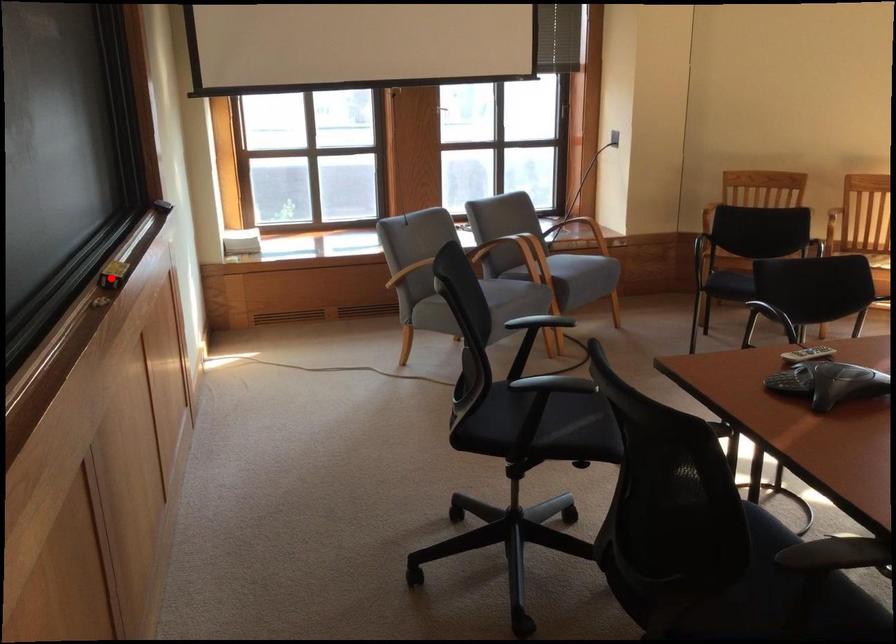
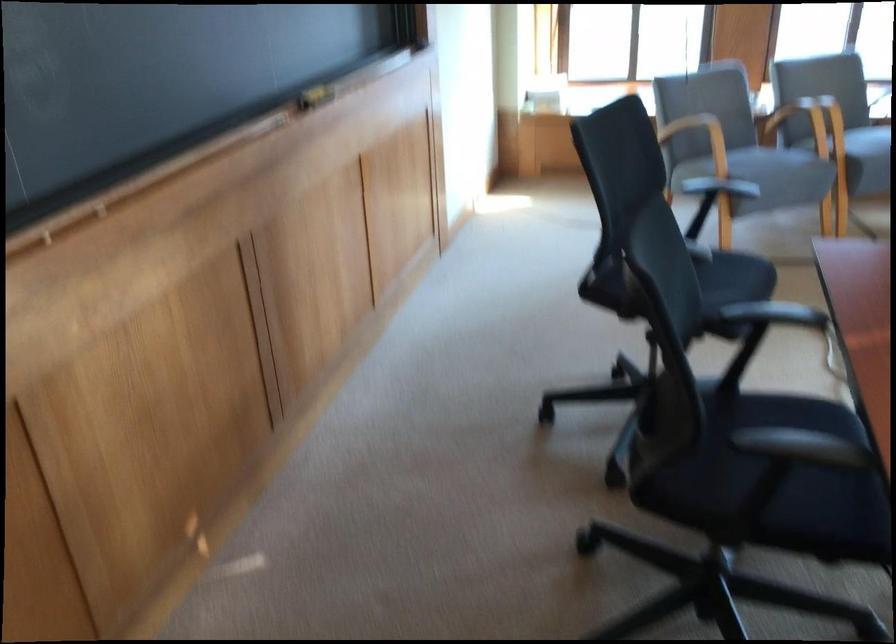
Where in the second image is the point corresponding to the highlighted location from the first image?

(314, 96)